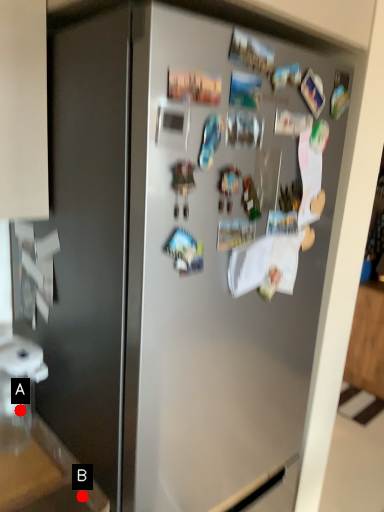
Question: Two points are circled on the image, labeled by A and B beside each circle. Which point is further to the camera?

Choices:
 (A) A is further
 (B) B is further

Answer: (A)